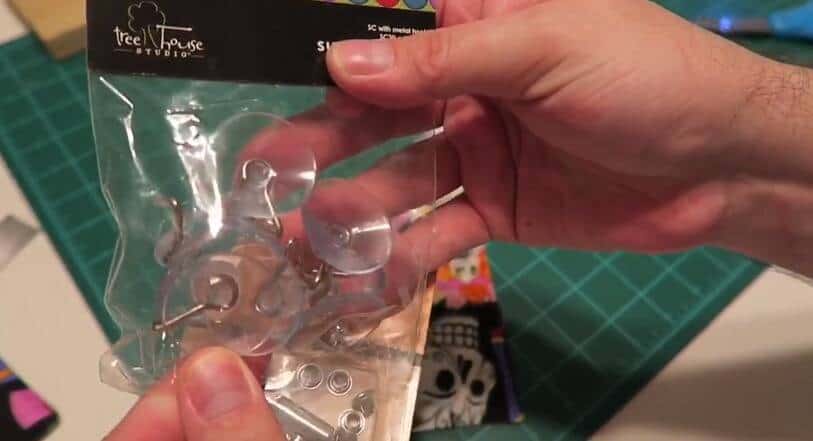
Locate an element on the screen. counter is located at coordinates (758, 368).